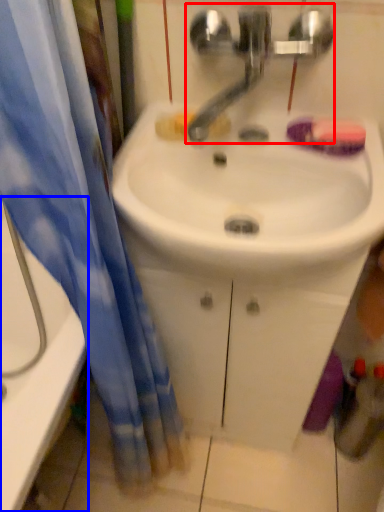
Question: Which object appears closest to the camera in this image, tap (highlighted by a red box) or bathtub (highlighted by a blue box)?

Choices:
 (A) tap
 (B) bathtub

Answer: (A)